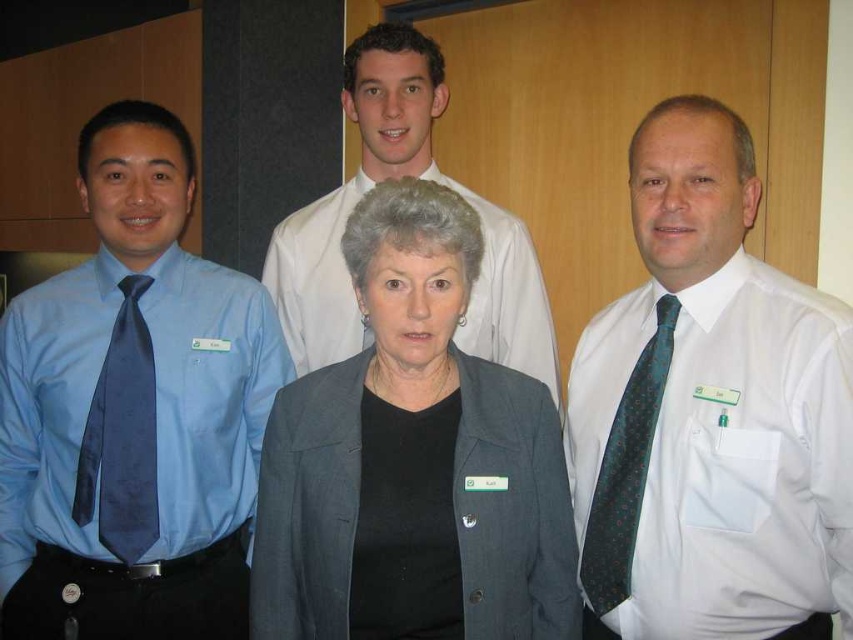
The height and width of the screenshot is (640, 853). Find the location of `white shirt at right`. white shirt at right is located at coordinates (711, 413).

Does white shirt at right have a larger size compared to matte blue shirt at left?

Incorrect, white shirt at right is not larger than matte blue shirt at left.

Does point (695, 292) come in front of point (231, 508)?

Yes.

Image resolution: width=853 pixels, height=640 pixels. What are the coordinates of `white shirt at right` in the screenshot? It's located at (711, 413).

Which is above, matte blue tie at left or green dotted silk tie at right?

matte blue tie at left

Who is lower down, matte blue tie at left or green dotted silk tie at right?

green dotted silk tie at right is lower down.

Image resolution: width=853 pixels, height=640 pixels. Identify the location of matte blue tie at left. coord(122,436).

The width and height of the screenshot is (853, 640). I want to click on matte blue tie at left, so click(x=122, y=436).

Based on the photo, between matte blue shirt at left and white shirt at upper center, which one is positioned higher?

white shirt at upper center is higher up.

Identify the location of matte blue shirt at left. This screenshot has width=853, height=640. (132, 412).